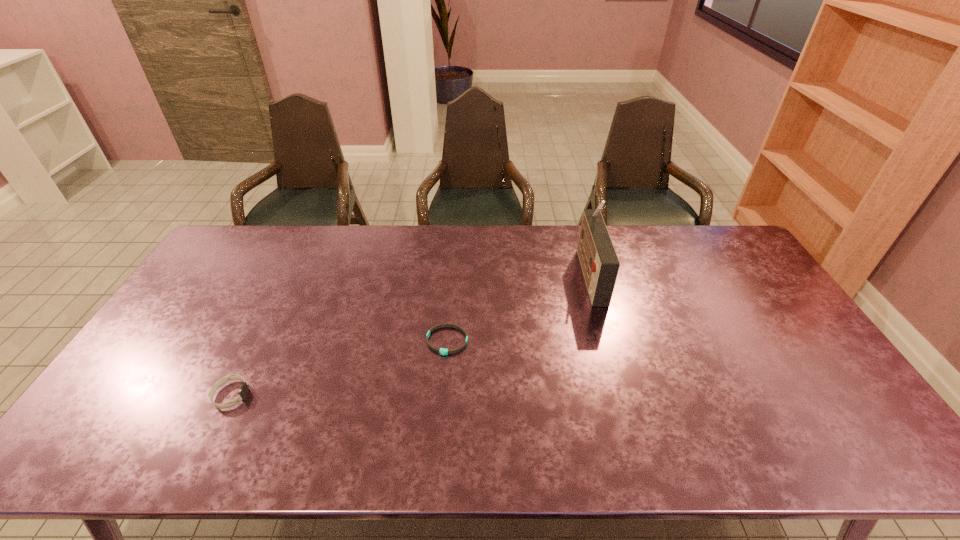
At what (x,y) coordinates should I click in order to perform the action: click on the rightmost object. Please return your answer as a coordinate pair (x, y). The image size is (960, 540). Looking at the image, I should click on (599, 261).

Where is `radio receiver`? This screenshot has width=960, height=540. radio receiver is located at coordinates (599, 261).

You are a GUI agent. You are given a task and a screenshot of the screen. Output one action in this format:
    pyautogui.click(x=<x>, y=<y>)
    Task: Click on the nearer wristband
    The image size is (960, 540).
    Given the screenshot: What is the action you would take?
    pyautogui.click(x=244, y=389)

Locate an element on the screen. The image size is (960, 540). the second tallest object is located at coordinates (244, 389).

This screenshot has width=960, height=540. I want to click on the second object from left to right, so click(x=443, y=351).

Image resolution: width=960 pixels, height=540 pixels. Identify the location of the farther wristband. (443, 351).

Where is `blank area located 0.060m on the front panel of the rightmost object`? This screenshot has width=960, height=540. blank area located 0.060m on the front panel of the rightmost object is located at coordinates (563, 274).

I want to click on vacant region located 0.270m on the front panel of the rightmost object, so click(500, 274).

At what (x,y) coordinates should I click in order to perform the action: click on vacant point located on the front panel of the rightmost object. Please return your answer as a coordinate pair (x, y). The width and height of the screenshot is (960, 540). Looking at the image, I should click on (462, 274).

Locate an element on the screen. vacant region located on the outer surface of the taller wristband is located at coordinates (275, 395).